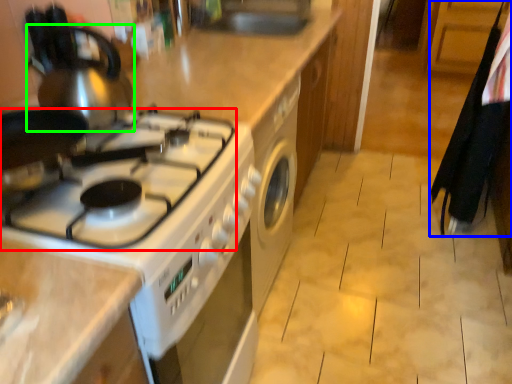
Question: Which object is positioned farthest from gas stove (highlighted by a red box)? Select from laundry (highlighted by a blue box) and tea pot (highlighted by a green box).

Choices:
 (A) laundry
 (B) tea pot

Answer: (A)